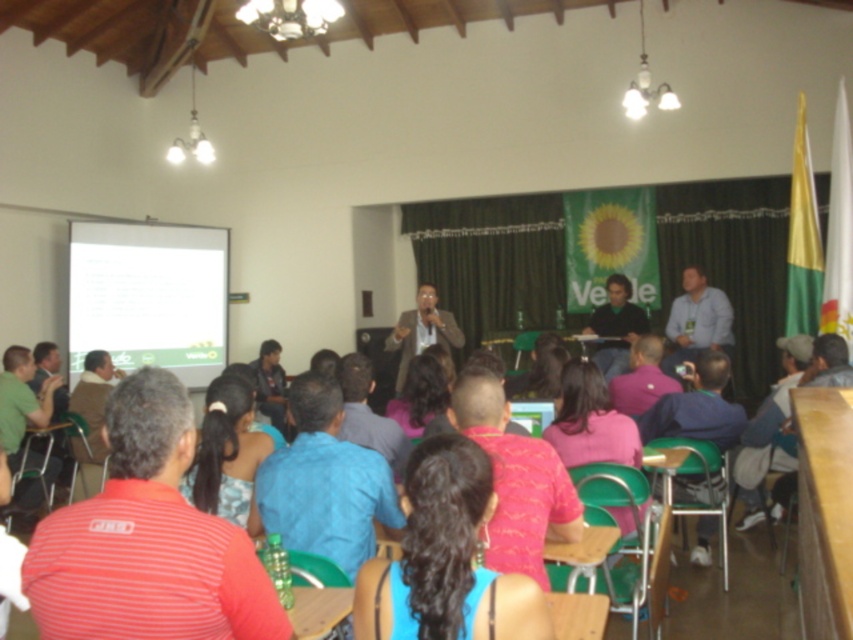
Is white matte projection screen at left smaller than dark blue shirt at center?

No.

Looking at this image, measure the distance between white matte projection screen at left and camera.

white matte projection screen at left and camera are 7.58 meters apart.

Where is `white matte projection screen at left`? This screenshot has width=853, height=640. white matte projection screen at left is located at coordinates (148, 296).

Between point (77, 544) and point (503, 481), which one is positioned behind?

The point (503, 481) is behind.

Is point (154, 637) in front of point (544, 456)?

Yes, it is in front of point (544, 456).

I want to click on striped polo shirt at lower left, so click(x=148, y=540).

Consider the image. Which is more to the left, striped polo shirt at lower left or blue shirt at center?

striped polo shirt at lower left

Does striped polo shirt at lower left have a lesser height compared to blue shirt at center?

In fact, striped polo shirt at lower left may be taller than blue shirt at center.

You are a GUI agent. You are given a task and a screenshot of the screen. Output one action in this format:
    pyautogui.click(x=<x>, y=<y>)
    Task: Click on the striped polo shirt at lower left
    The image size is (853, 640).
    Given the screenshot: What is the action you would take?
    pyautogui.click(x=148, y=540)